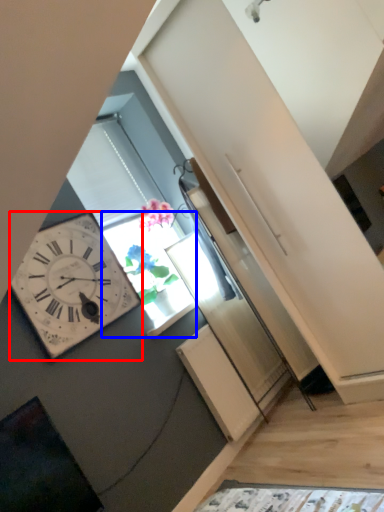
Question: Which object is further to the camera taking this photo, wall clock (highlighted by a red box) or window (highlighted by a blue box)?

Choices:
 (A) wall clock
 (B) window

Answer: (B)